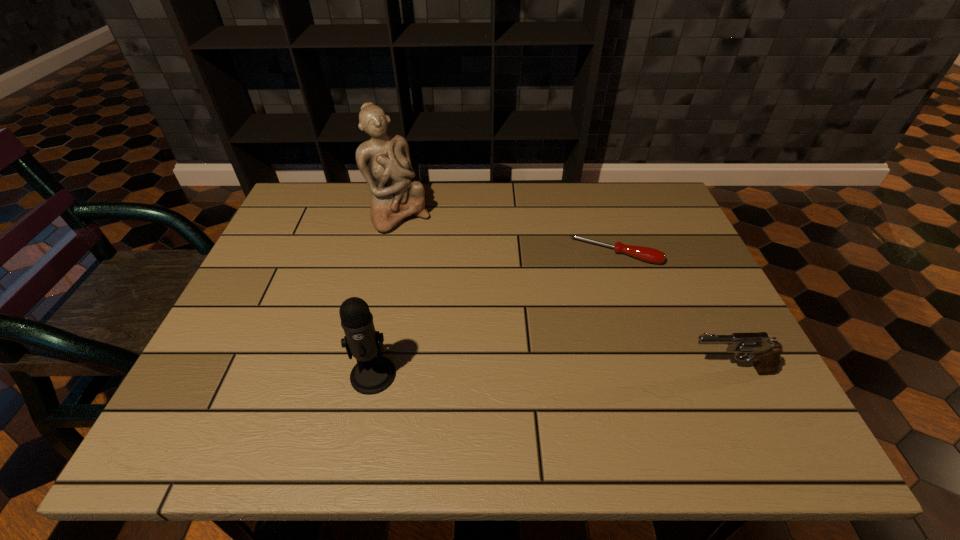
Image resolution: width=960 pixels, height=540 pixels. Identify the location of microphone. (372, 374).

Identify the location of the third tallest object. This screenshot has height=540, width=960. (766, 354).

Where is `the shortest object`? This screenshot has width=960, height=540. the shortest object is located at coordinates (647, 254).

Locate an element on the screen. The height and width of the screenshot is (540, 960). the second farthest object is located at coordinates (647, 254).

This screenshot has height=540, width=960. Identify the location of figurine. (384, 161).

Where is `the tallest object`? the tallest object is located at coordinates (x=384, y=161).

Where is `vacant space located on the back of the microphone`? Image resolution: width=960 pixels, height=540 pixels. vacant space located on the back of the microphone is located at coordinates (392, 283).

This screenshot has width=960, height=540. I want to click on free space located 0.080m at the barrel of the third tallest object, so click(x=645, y=370).

Locate an element on the screen. free location located at the barrel of the third tallest object is located at coordinates (495, 370).

Where is `free location located 0.230m at the barrel of the third tallest object`? free location located 0.230m at the barrel of the third tallest object is located at coordinates (572, 370).